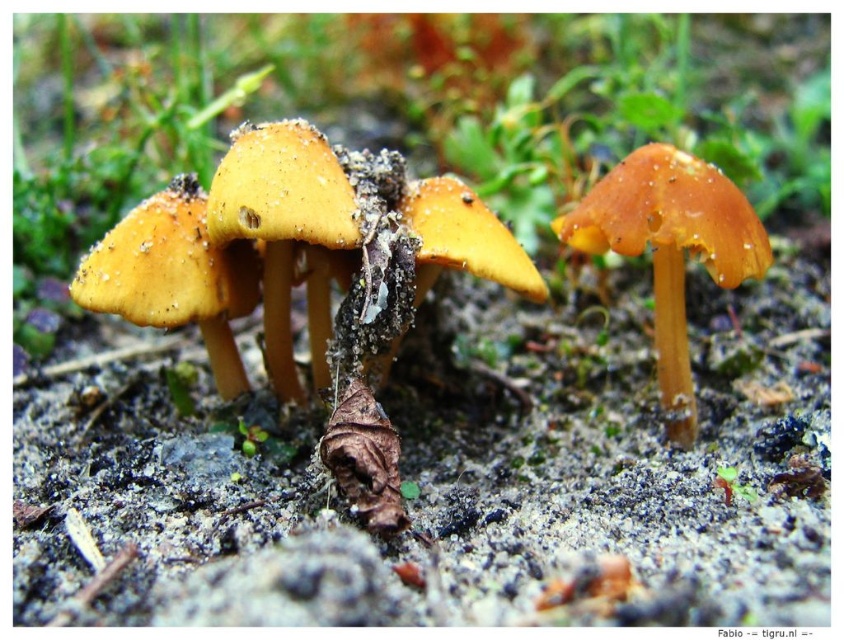
Is point (630, 256) positioned before point (230, 385)?

Yes, it is in front of point (230, 385).

Where is `orange matte mushroom at center`? The image size is (844, 640). orange matte mushroom at center is located at coordinates (669, 248).

Between point (282, 292) and point (636, 154), which one is positioned in front?

Point (636, 154) is more forward.

Can you confirm if yellow matte mushroom at center is shorter than orange matte mushroom at center?

Indeed, yellow matte mushroom at center has a lesser height compared to orange matte mushroom at center.

Is point (274, 125) more distant than point (736, 252)?

Yes.

Where is `yellow matte mushroom at center`? The height and width of the screenshot is (640, 844). yellow matte mushroom at center is located at coordinates (287, 232).

Between point (219, 237) and point (214, 346), which one is positioned in front?

Point (219, 237) is in front.

Does yellow matte mushroom at center appear on the right side of matte yellow mushroom at left?

Indeed, yellow matte mushroom at center is positioned on the right side of matte yellow mushroom at left.

Does point (220, 202) come farther from viewer compared to point (111, 280)?

No, (220, 202) is closer to viewer.

You are a GUI agent. You are given a task and a screenshot of the screen. Output one action in this format:
    pyautogui.click(x=<x>, y=<y>)
    Task: Click on the yellow matte mushroom at center
    
    Given the screenshot: What is the action you would take?
    pyautogui.click(x=287, y=232)